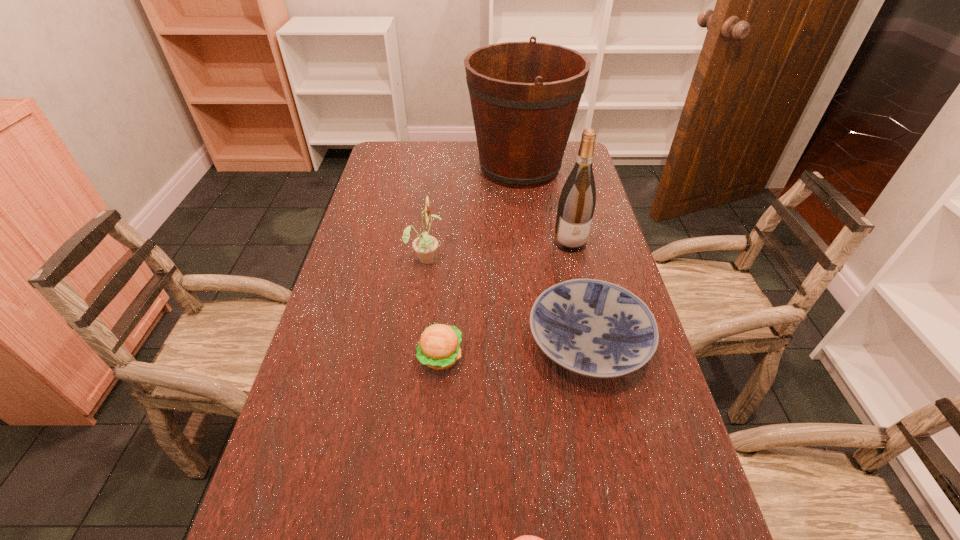
Locate an element on the screen. Image resolution: width=960 pixels, height=540 pixels. free space between the bucket and the plate is located at coordinates (554, 255).

Locate an element on the screen. This screenshot has height=540, width=960. free spot between the plate and the hamburger is located at coordinates (515, 349).

You are a GUI agent. You are given a task and a screenshot of the screen. Output one action in this format:
    pyautogui.click(x=<x>, y=<y>)
    Task: Click on the free area in between the farthest object and the hamburger
    
    Given the screenshot: What is the action you would take?
    pyautogui.click(x=480, y=262)

Locate an element on the screen. Image resolution: width=960 pixels, height=540 pixels. empty space that is in between the sunflower and the farthest object is located at coordinates (472, 213).

Identify the location of free space that is in between the hamburger and the plate. (515, 349).

Locate an element on the screen. empty location between the fourth shortest object and the wine bottle is located at coordinates (498, 251).

The width and height of the screenshot is (960, 540). I want to click on object that is the fifth closest to the farthest object, so click(525, 539).

Locate which object is the fourth closest to the third tallest object. Please provide its 2D coordinates. Your answer should be formatted as a tuple, i.e. [(x, y)], where the tuple contains the x and y coordinates of a point satisfying the conditions above.

[(576, 205)]

Image resolution: width=960 pixels, height=540 pixels. Identify the location of vacant region that satisfies the following two spatial constraints: 1. on the front-facing side of the plate; 2. on the left side of the sunflower. (415, 342).

You are a GUI agent. You are given a task and a screenshot of the screen. Output one action in this format:
    pyautogui.click(x=<x>, y=<y>)
    Task: Click on the blank space that satisfies the following two spatial constraints: 1. on the back side of the hamburger; 2. on the left side of the plate
    This screenshot has height=540, width=960.
    Given the screenshot: What is the action you would take?
    pyautogui.click(x=442, y=342)